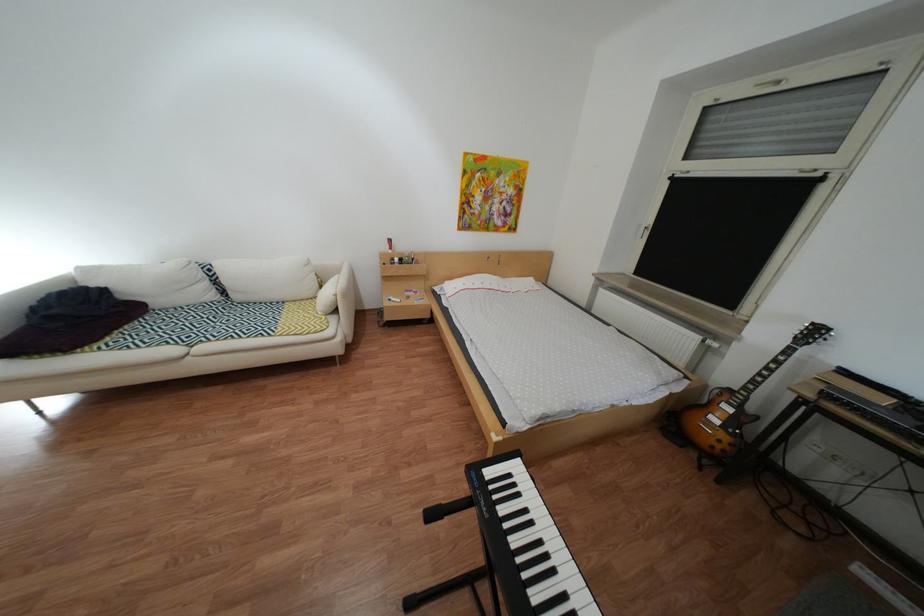
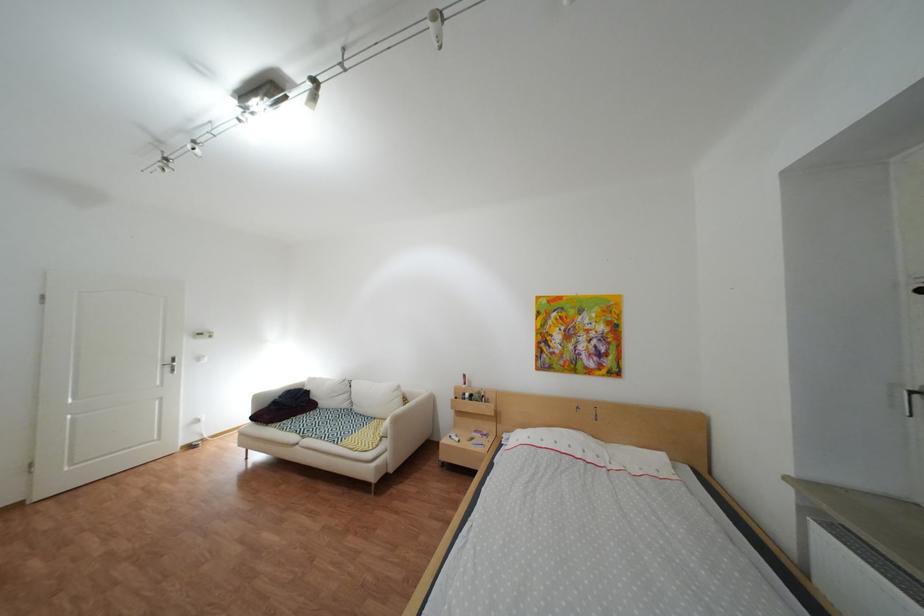
In the second image, find the point that corresponds to pixel 323 262 in the first image.

(415, 389)